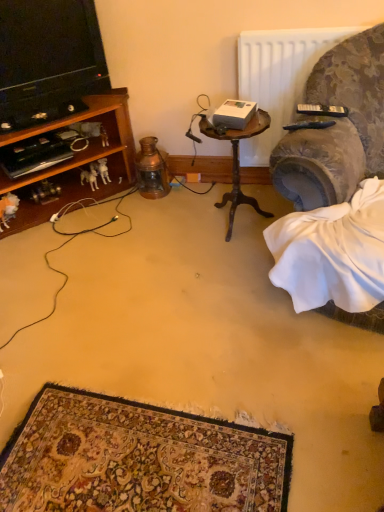
Question: Can you confirm if white plastic dog at lower left is taller than black plastic remote control at upper right, placed as the 1th remote control when sorted from front to back?

Choices:
 (A) yes
 (B) no

Answer: (A)

Question: Does white plastic dog at lower left lie in front of black plastic remote control at upper right, the 2th remote control when ordered from back to front?

Choices:
 (A) no
 (B) yes

Answer: (A)

Question: Is white plastic dog at lower left with black plastic remote control at upper right, placed as the 1th remote control when sorted from front to back?

Choices:
 (A) no
 (B) yes

Answer: (A)

Question: Does white plastic dog at lower left appear on the right side of black plastic remote control at upper right, which ranks as the 2th remote control in top-to-bottom order?

Choices:
 (A) no
 (B) yes

Answer: (A)

Question: Can you confirm if white plastic dog at lower left is positioned to the left of black plastic remote control at upper right, the 1th remote control from the bottom?

Choices:
 (A) yes
 (B) no

Answer: (A)

Question: Can you confirm if white plastic dog at lower left is shorter than black plastic remote control at upper right, which ranks as the 2th remote control in top-to-bottom order?

Choices:
 (A) no
 (B) yes

Answer: (A)

Question: Can you confirm if black cable at left is wider than wooden table at center?

Choices:
 (A) yes
 (B) no

Answer: (A)

Question: Is black cable at left to the left of wooden table at center from the viewer's perspective?

Choices:
 (A) no
 (B) yes

Answer: (B)

Question: Would you consider black cable at left to be distant from wooden table at center?

Choices:
 (A) no
 (B) yes

Answer: (A)

Question: Would you say black cable at left contains wooden table at center?

Choices:
 (A) yes
 (B) no

Answer: (B)

Question: Is black cable at left further to camera compared to wooden table at center?

Choices:
 (A) yes
 (B) no

Answer: (B)

Question: From the image's perspective, does black cable at left appear lower than wooden table at center?

Choices:
 (A) no
 (B) yes

Answer: (B)

Question: Can you confirm if white plastic dog at lower left is thinner than white fabric at lower right?

Choices:
 (A) no
 (B) yes

Answer: (B)